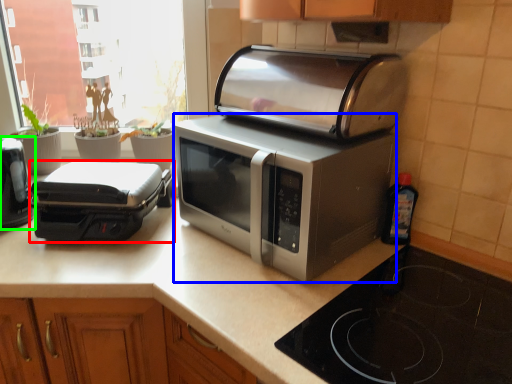
Question: Which object is positioned farthest from toaster (highlighted by a red box)? Select from microwave oven (highlighted by a blue box) and toaster (highlighted by a green box).

Choices:
 (A) microwave oven
 (B) toaster

Answer: (A)